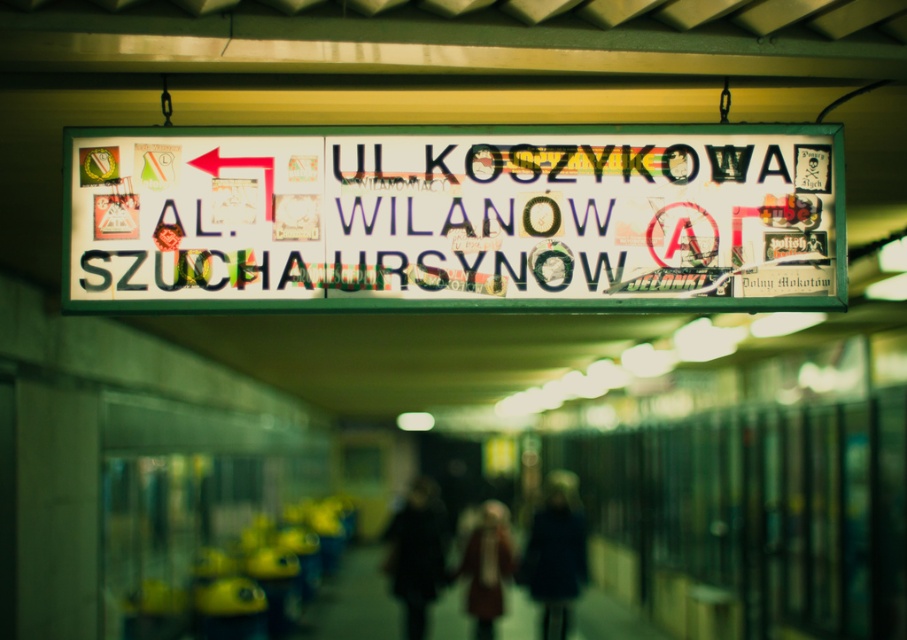
You are a painter standing in front of the white paper sign at center and the red wool coat at center. You want to paint both items but need to know which one is shorter. Which object is shorter?

The white paper sign at center has a lesser height compared to the red wool coat at center, so the white paper sign at center is shorter.

You are standing in the pedestrian area and see the white paper sign at center. Is the point at coordinate (x=456, y=218) located on the sign?

Yes, the point at coordinate (x=456, y=218) is located on the white paper sign at center.

You are a delivery person holding a dark brown leather coat at center and need to hang it on a hook near the white paper sign at center. Can you hang the coat without folding it if the hook is the same size as the sign?

The white paper sign at center is larger in size than dark brown leather coat at center, so the hook that fits the sign should be large enough to hold the coat without folding it.